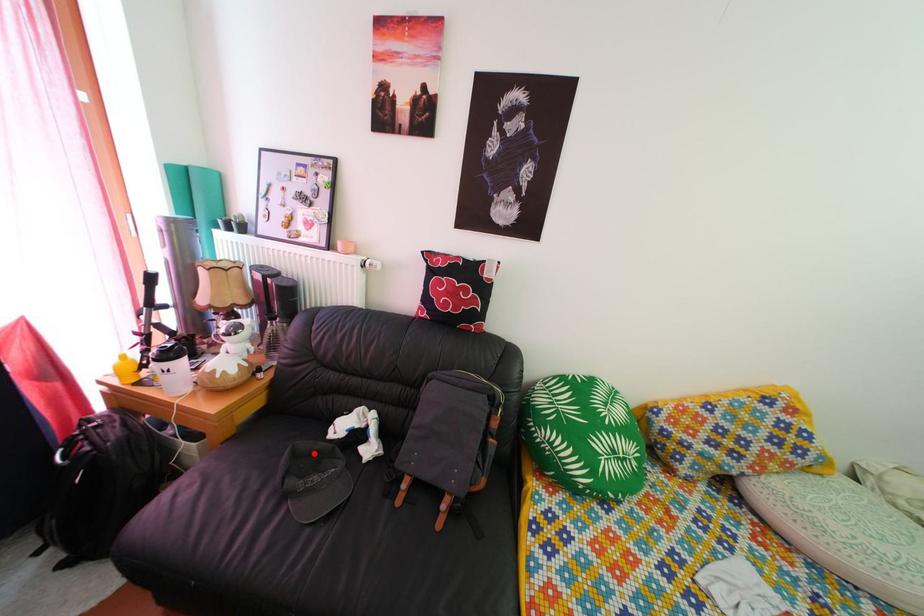
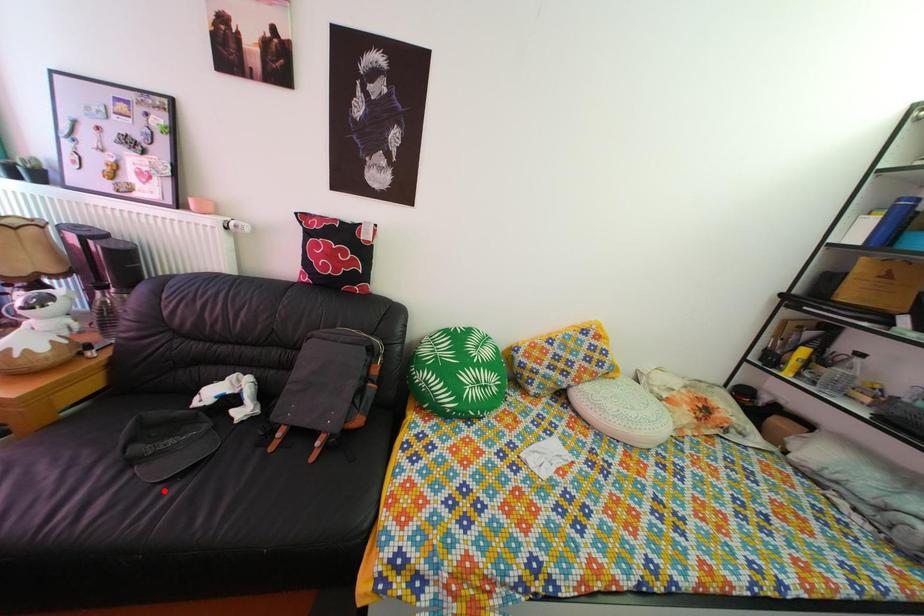
I am providing you with two images of the same scene from different viewpoints. A red point is marked on the first image and another point is marked on the second image. Is the marked point in image1 the same physical position as the marked point in image2?

No